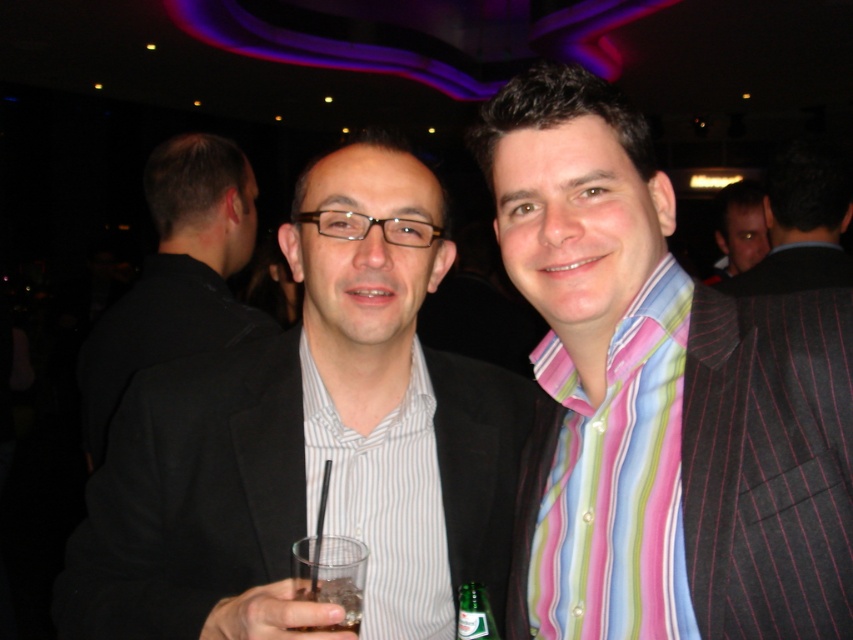
You are a photographer at a social event and need to capture a closeup shot of both the dark brown hair at upper right and the green glass bottle at center. Given that your camera has a maximum focus range of 2 meters, will you be able to capture both subjects in focus at the same time?

The dark brown hair at upper right and the green glass bottle at center are 2.84 meters apart. Since the camera can only focus within 2 meters, the distance between them exceeds the focus range. Therefore, you cannot capture both in focus simultaneously.

You are a photographer at a social event and want to adjust the lighting so that the green glass bottle at center is more visible without obscuring the matte black suit at center. Which object should you focus on adjusting the light towards?

The matte black suit at center is positioned over green glass bottle at center, so adjusting the light towards the area where the matte black suit at center is located would help make both objects visible while ensuring the green glass bottle at center isn not overshadowed.

You are a photographer at a party and need to adjust the lighting so that both the dark brown hair at upper right and the green glass bottle at center are equally illuminated. Given their sizes, which object might require more light adjustment and why?

The dark brown hair at upper right is much taller than the green glass bottle at center, so it might require more light adjustment to ensure proper illumination due to its greater height.